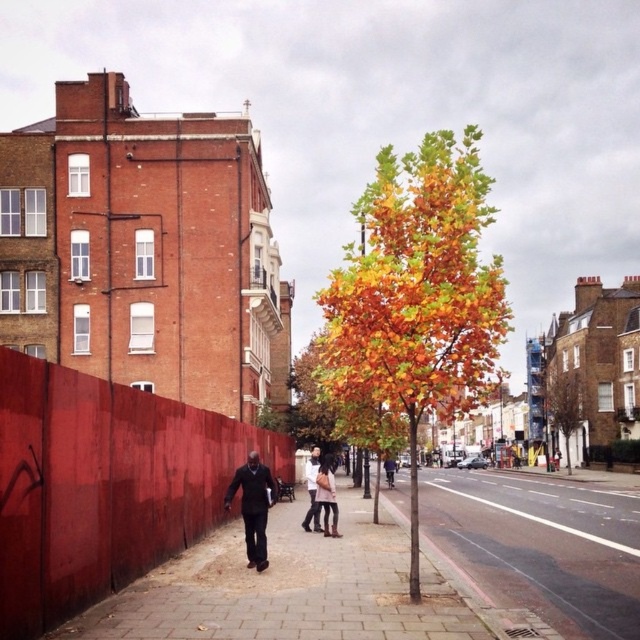
Does autumn leaves tree at center appear on the left side of brown textured tree at center?

Yes, autumn leaves tree at center is to the left of brown textured tree at center.

Does point (339, 282) come in front of point (556, 417)?

Yes, point (339, 282) is closer to viewer.

Where is `autumn leaves tree at center`? This screenshot has width=640, height=640. autumn leaves tree at center is located at coordinates (417, 296).

Is point (216, 500) positioned in front of point (404, 209)?

No, (216, 500) is further to viewer.

Looking at this image, can you confirm if red painted wooden fence at left is positioned to the right of autumn leaves tree at center?

Incorrect, red painted wooden fence at left is not on the right side of autumn leaves tree at center.

The width and height of the screenshot is (640, 640). Find the location of `red painted wooden fence at left`. red painted wooden fence at left is located at coordinates (102, 484).

Can you confirm if red painted wooden fence at left is thinner than smooth concrete pavement at center?

Yes.

Identify the location of red painted wooden fence at left. (102, 484).

Is point (44, 570) positioned behind point (461, 499)?

That is False.

Locate an element on the screen. This screenshot has height=640, width=640. red painted wooden fence at left is located at coordinates (102, 484).